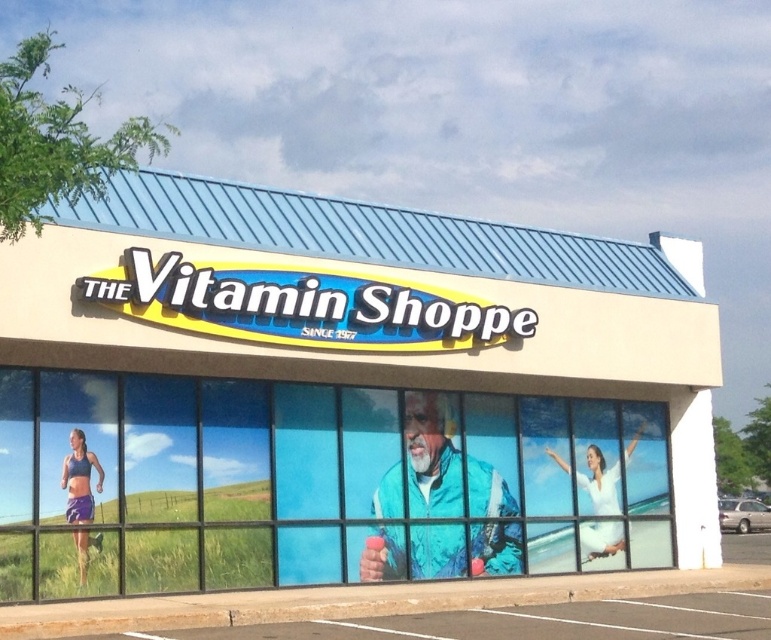
You are standing in front of The Vitamin Shoppe and want to take a photo of the white sign at center and the silver metallic car at lower right. Which object should you zoom in on to ensure both are in frame without moving your camera?

You should zoom in on the silver metallic car at lower right because the white sign at center is much taller than the silver metallic car at lower right, so focusing on the smaller object will help keep both in frame.

You are a customer approaching the store and see the white sign at center and the silver metallic car at lower right. Which object is closer to you as you walk towards the entrance?

The white sign at center is closer to you because it is in front of the silver metallic car at lower right, indicating it is nearer to your position as you approach the entrance.

You are a delivery driver who needs to park your silver metallic car at lower right near the entrance of The Vitamin Shoppe. The parking spot available is exactly the same width as the white sign at center. Can your car fit into this parking spot?

The white sign at center is wider than the silver metallic car at lower right, so the parking spot, which matches the sign width, should be wide enough for the car to fit.